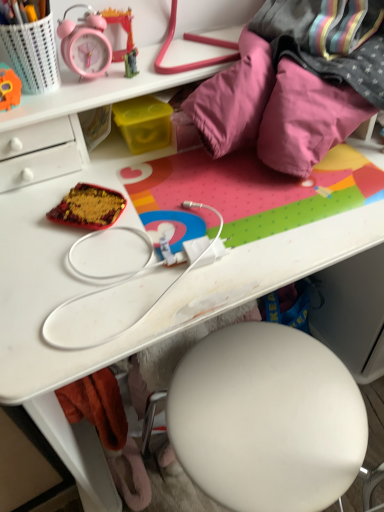
Question: Does point (16, 89) appear closer or farther from the camera than point (112, 215)?

Choices:
 (A) farther
 (B) closer

Answer: (A)

Question: From the image's perspective, is orange plush toy at upper left positioned above or below shiny red fabric at center?

Choices:
 (A) below
 (B) above

Answer: (B)

Question: Estimate the real-world distances between objects in this image. Which object is farther from the shiny red fabric at center?

Choices:
 (A) yellow plastic container at center, the 1th stationery viewed from the right
 (B) orange plush toy at upper left
 (C) matte plastic alarm clock at upper left, placed as the second stationery when sorted from right to left
 (D) matte plastic pencil case at upper left, the third stationery from the right

Answer: (C)

Question: Considering the real-world distances, which object is closest to the orange plush toy at upper left?

Choices:
 (A) shiny red fabric at center
 (B) matte plastic pencil case at upper left, the 1th stationery in the left-to-right sequence
 (C) matte plastic alarm clock at upper left, placed as the second stationery when sorted from right to left
 (D) yellow plastic container at center, the 1th stationery viewed from the right

Answer: (B)